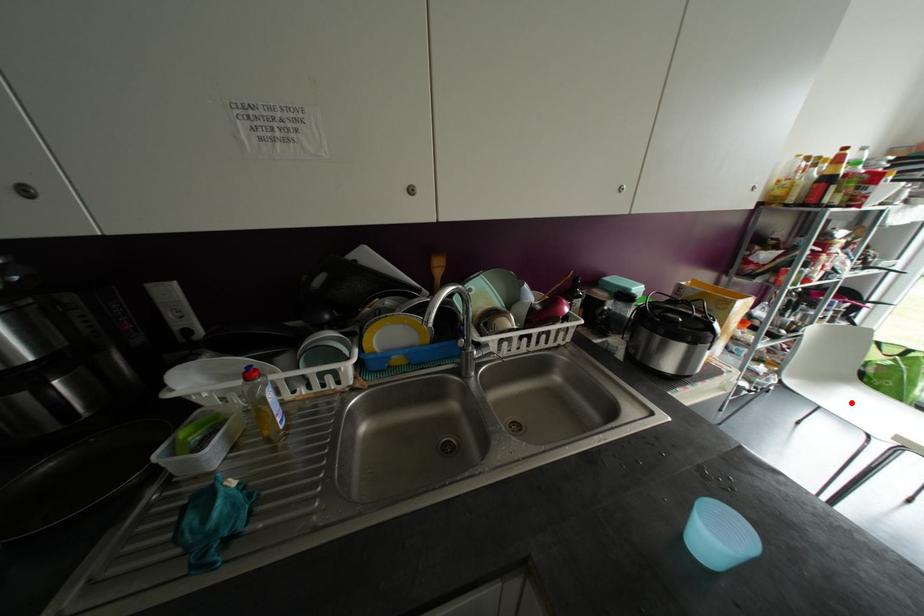
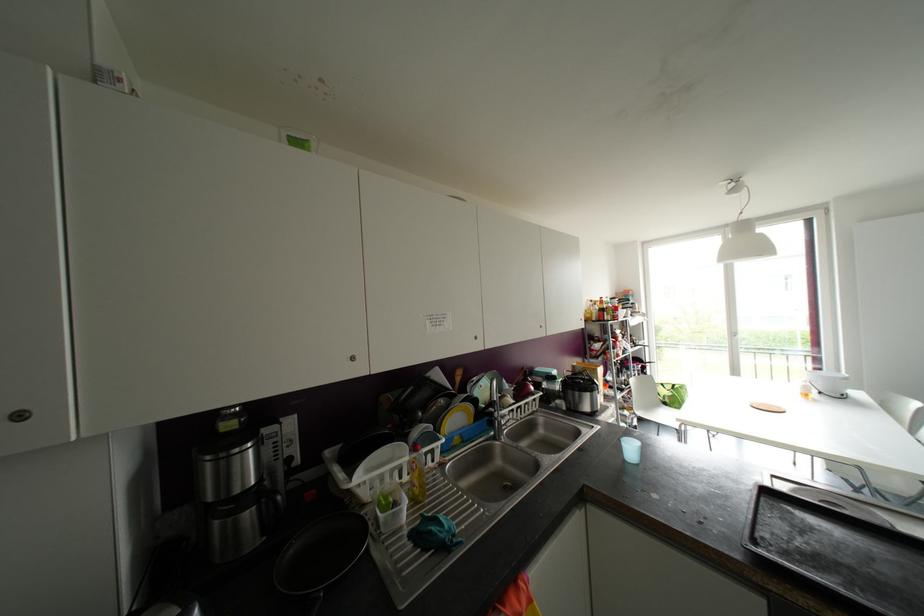
Question: I am providing you with two images of the same scene from different viewpoints. In image1, a red point is highlighted. Considering the same 3D point in image2, which of the following is correct?

Choices:
 (A) It is closer
 (B) It is farther

Answer: (B)